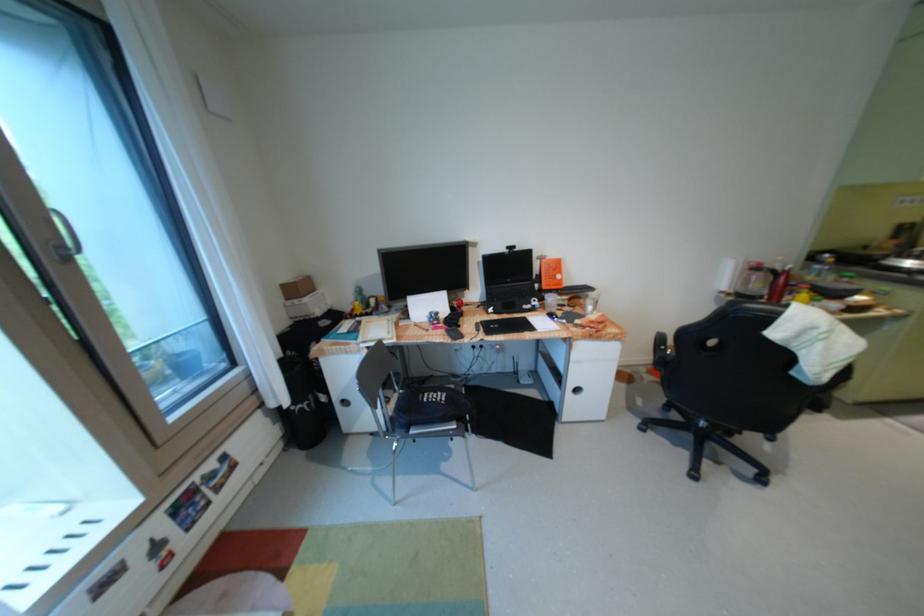
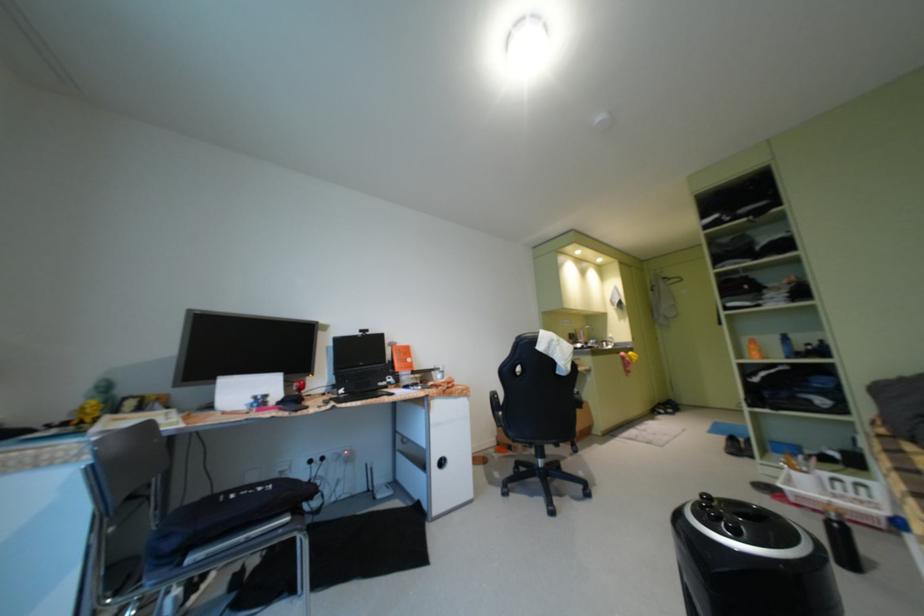
The first image is from the beginning of the video and the second image is from the end. How did the camera likely rotate when shooting the video?

The rotation direction of the camera is right-up.